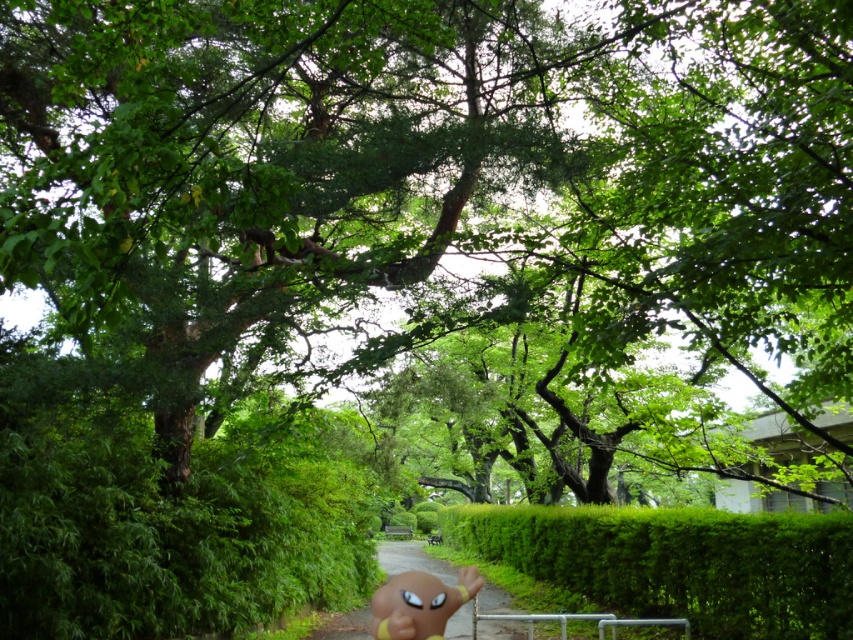
Question: Among these points, which one is nearest to the camera?

Choices:
 (A) (392, 586)
 (B) (762, 614)
 (C) (480, 596)

Answer: (A)

Question: Does green leafy hedge at center appear on the left side of green grassy path at center?

Choices:
 (A) yes
 (B) no

Answer: (B)

Question: Is green grassy path at center wider than yellow rubber doll at lower center?

Choices:
 (A) yes
 (B) no

Answer: (A)

Question: Estimate the real-world distances between objects in this image. Which object is farther from the green grassy path at center?

Choices:
 (A) green leafy hedge at center
 (B) yellow rubber doll at lower center

Answer: (B)

Question: Which of the following is the closest to the observer?

Choices:
 (A) (405, 593)
 (B) (467, 520)

Answer: (A)

Question: Observing the image, what is the correct spatial positioning of green grassy path at center in reference to yellow rubber doll at lower center?

Choices:
 (A) below
 (B) above

Answer: (A)